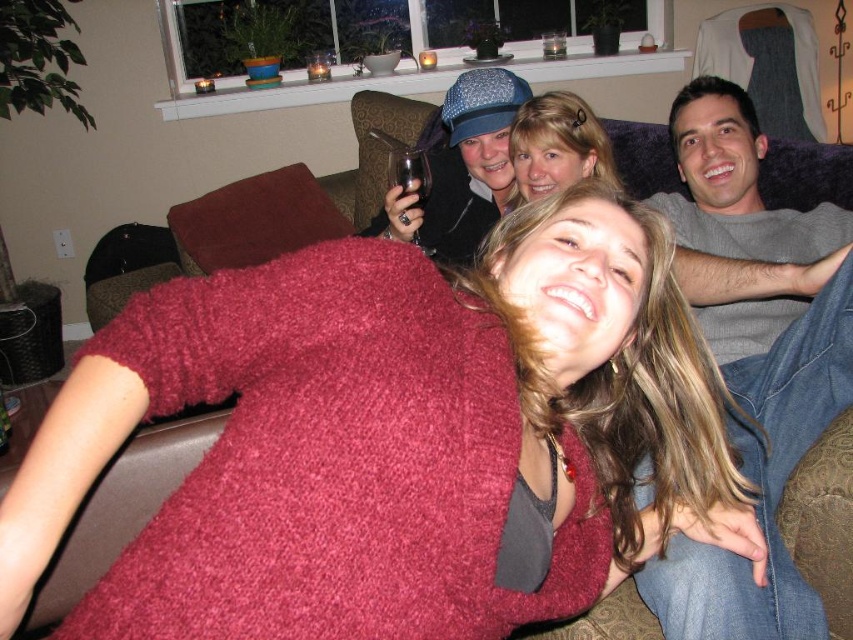
You are a photographer trying to capture a candid shot of the blonde hair at center without the fuzzy red sweater at center blocking it. What adjustment should you make to your camera angle?

To capture the blonde hair at center without the fuzzy red sweater at center blocking it, you should adjust your camera angle to look behind the fuzzy red sweater at center.

You are standing in the living room and want to locate the gray soft shirt at upper right. Where exactly is it positioned in the image?

The gray soft shirt at upper right is located at point 0.558 on the horizontal axis and 0.883 on the vertical axis.

You are organizing a charity event and need to determine which clothing item to donate first based on size. Given the fuzzy red sweater at center and the gray soft shirt at upper right, which one should you choose if you want to donate the smaller item first?

The fuzzy red sweater at center has a smaller size compared to the gray soft shirt at upper right, so you should donate the fuzzy red sweater at center first.